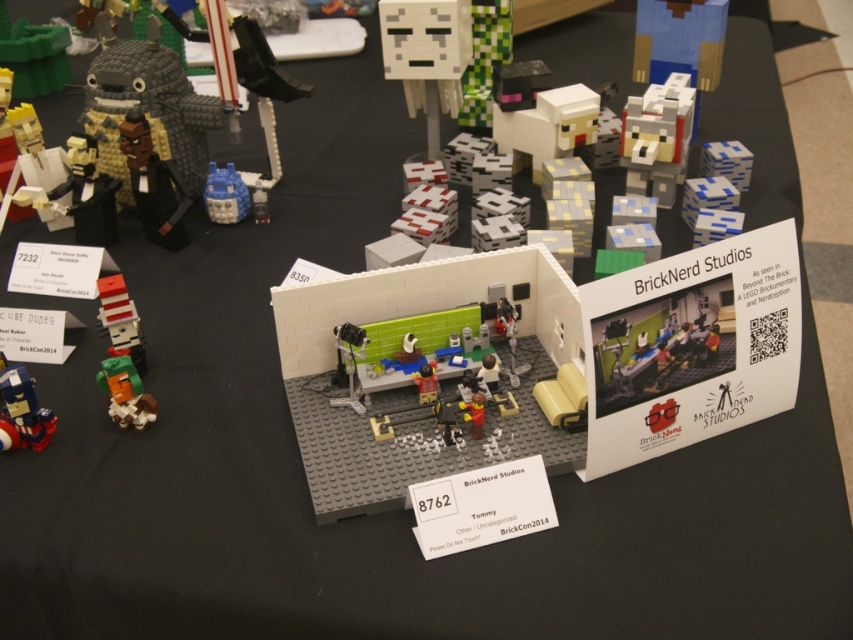
Question: Based on their relative distances, which object is nearer to the translucent blue plastic at center?

Choices:
 (A) matte red brick at left
 (B) shiny blue plastic robot at lower left

Answer: (A)

Question: Which of the following is the farthest from the observer?

Choices:
 (A) matte red brick at left
 (B) green matte creeper at lower left
 (C) translucent blue plastic at center

Answer: (C)

Question: From the image, what is the correct spatial relationship of green matte creeper at lower left in relation to translucent blue plastic at center?

Choices:
 (A) left
 (B) right

Answer: (A)

Question: Is green matte creeper at lower left wider than translucent blue plastic at center?

Choices:
 (A) yes
 (B) no

Answer: (B)

Question: Estimate the real-world distances between objects in this image. Which object is closer to the translucent blue plastic at center?

Choices:
 (A) green matte creeper at lower left
 (B) matte red brick at left
 (C) shiny blue plastic robot at lower left

Answer: (B)

Question: Is the position of shiny blue plastic robot at lower left less distant than that of green matte creeper at lower left?

Choices:
 (A) no
 (B) yes

Answer: (B)